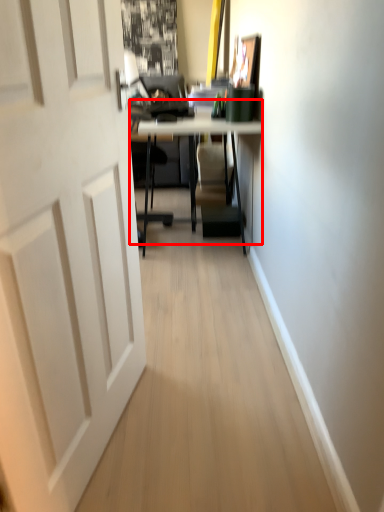
Question: Observing the image, what is the correct spatial positioning of table (annotated by the red box) in reference to door?

Choices:
 (A) left
 (B) right

Answer: (B)